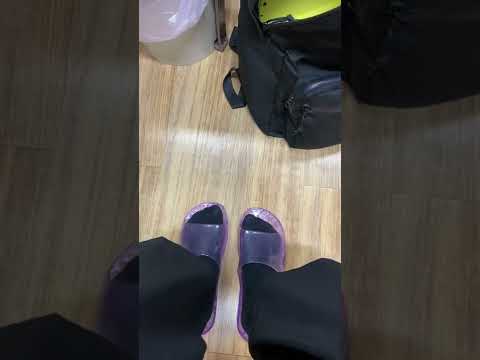
The width and height of the screenshot is (480, 360). I want to click on floor, so click(199, 184).